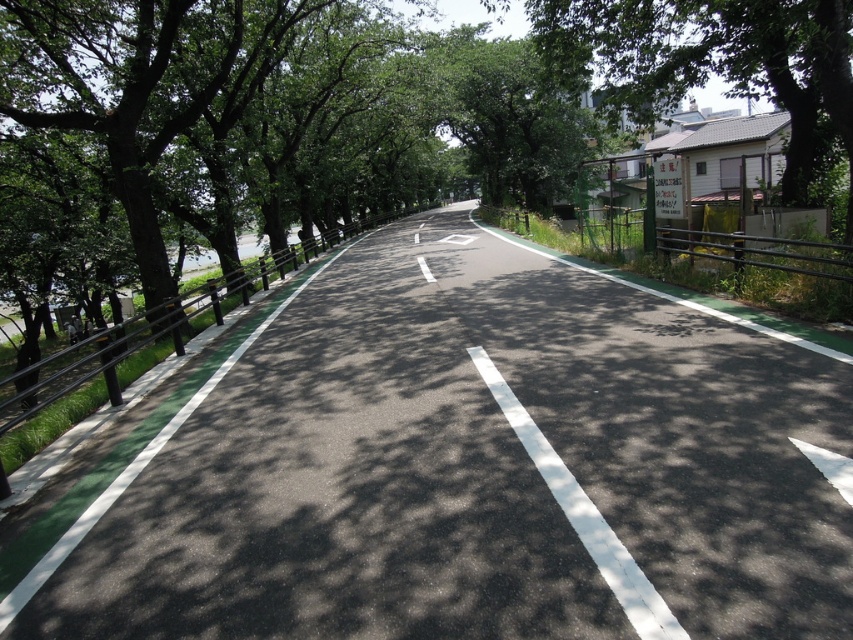
Does point (396, 230) come in front of point (844, 52)?

That is False.

Can you confirm if asphalt at left is thinner than green leafy tree at upper right?

Indeed, asphalt at left has a lesser width compared to green leafy tree at upper right.

Between point (397, 497) and point (613, 99), which one is positioned in front?

Point (397, 497)

Where is `asphalt at left`? asphalt at left is located at coordinates (459, 467).

Who is lower down, green leafy tree at upper right or white asphalt road at center?

white asphalt road at center is lower down.

In order to click on green leafy tree at upper right in this screenshot , I will do `click(717, 61)`.

Locate an element on the screen. This screenshot has height=640, width=853. green leafy tree at upper right is located at coordinates (717, 61).

Between point (408, 429) and point (509, 241), which one is positioned in front?

Point (408, 429) is in front.

Is asphalt at left to the left of white asphalt road at center from the viewer's perspective?

Correct, you'll find asphalt at left to the left of white asphalt road at center.

Is point (554, 513) positioned after point (515, 404)?

No.

Where is `asphalt at left`? Image resolution: width=853 pixels, height=640 pixels. asphalt at left is located at coordinates (459, 467).